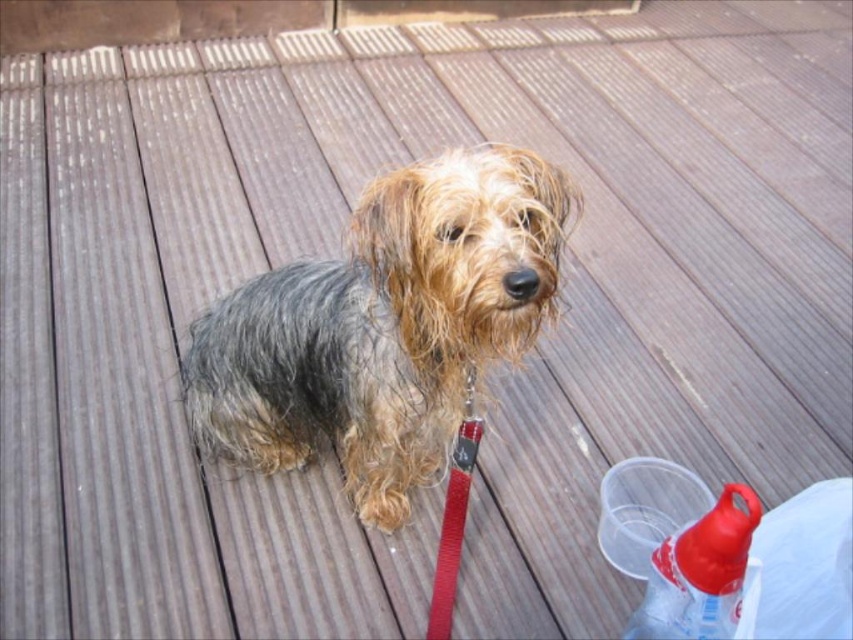
Is translucent plastic bottle at lower right shorter than red nylon leash at center?

Yes.

Is point (729, 620) less distant than point (440, 556)?

Yes.

Is point (720, 602) positioned before point (444, 592)?

Yes, point (720, 602) is in front of point (444, 592).

This screenshot has height=640, width=853. Find the location of `translucent plastic bottle at lower right`. translucent plastic bottle at lower right is located at coordinates (700, 573).

Where is `fuzzy fur dog at center`? Image resolution: width=853 pixels, height=640 pixels. fuzzy fur dog at center is located at coordinates (383, 326).

Between fuzzy fur dog at center and red nylon leash at center, which one appears on the left side from the viewer's perspective?

Positioned to the left is fuzzy fur dog at center.

Who is more forward, (380,406) or (447,500)?

Point (447,500) is in front.

The height and width of the screenshot is (640, 853). I want to click on fuzzy fur dog at center, so click(383, 326).

Can you confirm if fuzzy fur dog at center is positioned to the right of translucent plastic bottle at lower right?

In fact, fuzzy fur dog at center is to the left of translucent plastic bottle at lower right.

Is fuzzy fur dog at center bigger than translucent plastic bottle at lower right?

Indeed, fuzzy fur dog at center has a larger size compared to translucent plastic bottle at lower right.

Between point (479, 200) and point (698, 604), which one is positioned in front?

Point (479, 200) is more forward.

What are the coordinates of `fuzzy fur dog at center` in the screenshot? It's located at (x=383, y=326).